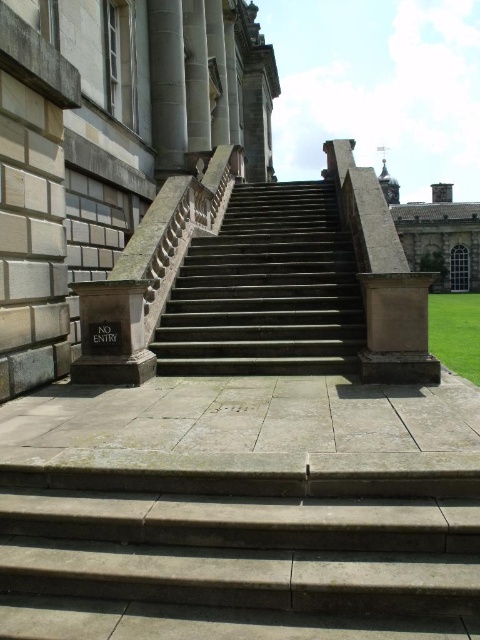
Question: Does dark gray stone stairs at center have a greater width compared to sandy stone pillar at center?

Choices:
 (A) no
 (B) yes

Answer: (A)

Question: Which of these objects is positioned farthest from the sandy stone pillar at center?

Choices:
 (A) gray stone stairs at lower center
 (B) dark gray stone stairs at center

Answer: (B)

Question: Can you confirm if dark gray stone stairs at center is positioned to the left of sandy stone pillar at center?

Choices:
 (A) yes
 (B) no

Answer: (A)

Question: Can you confirm if dark gray stone stairs at center is wider than slate gray stone column at upper left?

Choices:
 (A) no
 (B) yes

Answer: (A)

Question: Which point is closer to the camera?

Choices:
 (A) slate gray stone column at upper left
 (B) gray stone stairs at lower center

Answer: (B)

Question: Which of the following is the farthest from the observer?

Choices:
 (A) dark gray stone stairs at center
 (B) gray stone stairs at lower center
 (C) sandy stone pillar at center

Answer: (A)